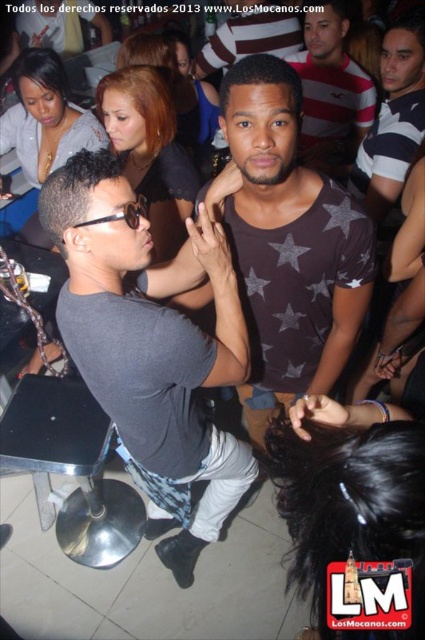
You are at a crowded party and need to navigate to a specific location. You have two points marked in the scene. Which point, point 1 at coordinates (76,168) or point 2 at coordinates (243,134), is closer to you?

Point 1 at coordinates (76,168) is closer to the viewer than point 2 at coordinates (243,134).